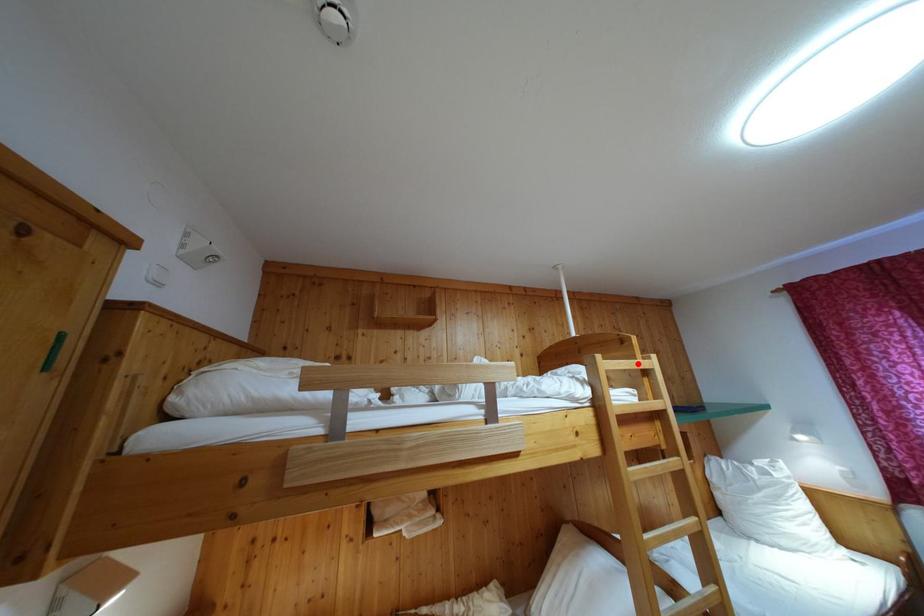
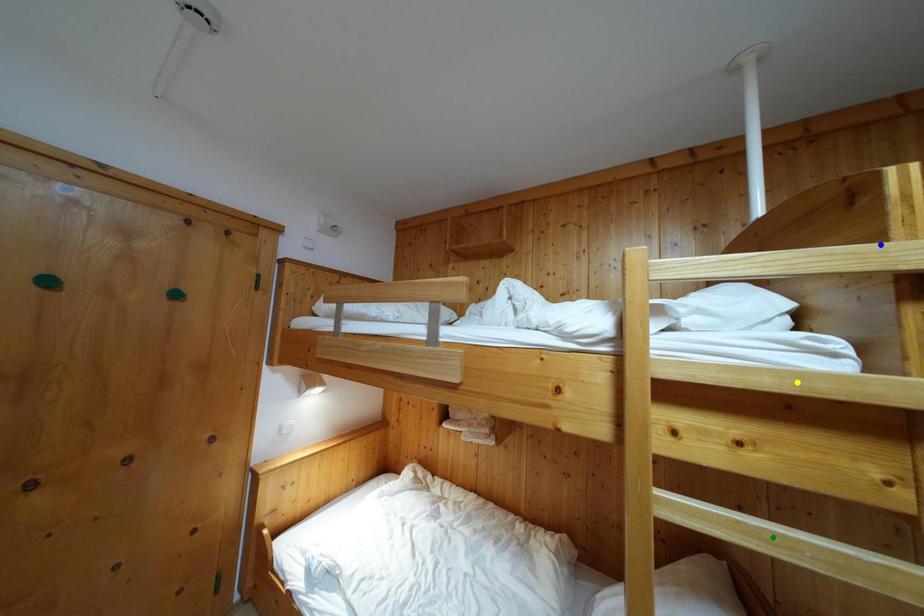
Question: I am providing you with two images of the same scene from different viewpoints. A red point is marked on the first image. You are given multiple points on the second image. In image 2, which mark is for the same physical point as the one in image 1?

Choices:
 (A) yellow point
 (B) blue point
 (C) green point

Answer: (B)